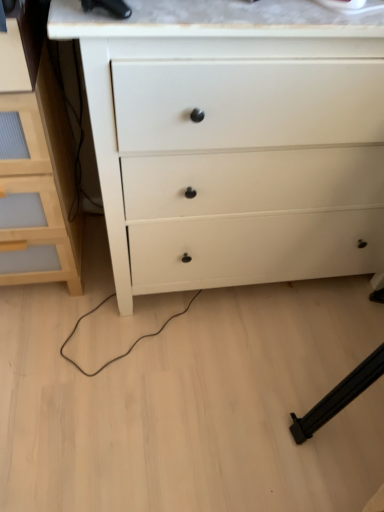
Question: From the image's perspective, is light wood chest of drawers at left, which is the first chest of drawers from left to right, below white matte chest of drawers at center, marked as the 1th chest of drawers in a right-to-left arrangement?

Choices:
 (A) yes
 (B) no

Answer: (A)

Question: Is light wood chest of drawers at left, which is the 2th chest of drawers from right to left, with white matte chest of drawers at center, the second chest of drawers viewed from the left?

Choices:
 (A) yes
 (B) no

Answer: (B)

Question: Is light wood chest of drawers at left, which is the first chest of drawers from left to right, shorter than white matte chest of drawers at center, the second chest of drawers viewed from the left?

Choices:
 (A) no
 (B) yes

Answer: (B)

Question: Is light wood chest of drawers at left, which is the 2th chest of drawers from right to left, to the right of white matte chest of drawers at center, the second chest of drawers viewed from the left, from the viewer's perspective?

Choices:
 (A) yes
 (B) no

Answer: (B)

Question: Can you confirm if light wood chest of drawers at left, which is the 2th chest of drawers from right to left, is positioned to the left of white matte chest of drawers at center, marked as the 1th chest of drawers in a right-to-left arrangement?

Choices:
 (A) no
 (B) yes

Answer: (B)

Question: From a real-world perspective, is light wood chest of drawers at left, which is the 2th chest of drawers from right to left, located beneath white matte chest of drawers at center, marked as the 1th chest of drawers in a right-to-left arrangement?

Choices:
 (A) yes
 (B) no

Answer: (A)

Question: Is white matte chest of drawers at center, the second chest of drawers viewed from the left, shorter than light wood chest of drawers at left, which is the first chest of drawers from left to right?

Choices:
 (A) no
 (B) yes

Answer: (A)

Question: Is white matte chest of drawers at center, the second chest of drawers viewed from the left, looking in the opposite direction of light wood chest of drawers at left, which is the 2th chest of drawers from right to left?

Choices:
 (A) yes
 (B) no

Answer: (B)

Question: From a real-world perspective, is white matte chest of drawers at center, the second chest of drawers viewed from the left, located beneath light wood chest of drawers at left, which is the 2th chest of drawers from right to left?

Choices:
 (A) yes
 (B) no

Answer: (B)

Question: Is white matte chest of drawers at center, the second chest of drawers viewed from the left, not within light wood chest of drawers at left, which is the 2th chest of drawers from right to left?

Choices:
 (A) yes
 (B) no

Answer: (A)

Question: Is white matte chest of drawers at center, marked as the 1th chest of drawers in a right-to-left arrangement, placed right next to light wood chest of drawers at left, which is the first chest of drawers from left to right?

Choices:
 (A) yes
 (B) no

Answer: (B)

Question: From the image's perspective, does white matte chest of drawers at center, the second chest of drawers viewed from the left, appear higher than light wood chest of drawers at left, which is the first chest of drawers from left to right?

Choices:
 (A) no
 (B) yes

Answer: (B)

Question: Looking at their shapes, would you say light wood chest of drawers at left, which is the first chest of drawers from left to right, is wider or thinner than white matte chest of drawers at center, the second chest of drawers viewed from the left?

Choices:
 (A) thin
 (B) wide

Answer: (A)